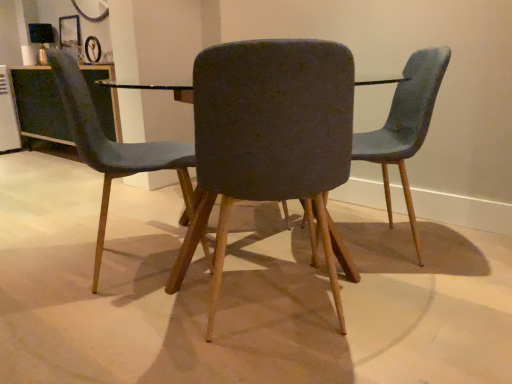
Where is `vacant space that is to the left of velvet blue chair at left, the 1th chair in the left-to-right sequence`? This screenshot has height=384, width=512. vacant space that is to the left of velvet blue chair at left, the 1th chair in the left-to-right sequence is located at coordinates (47, 257).